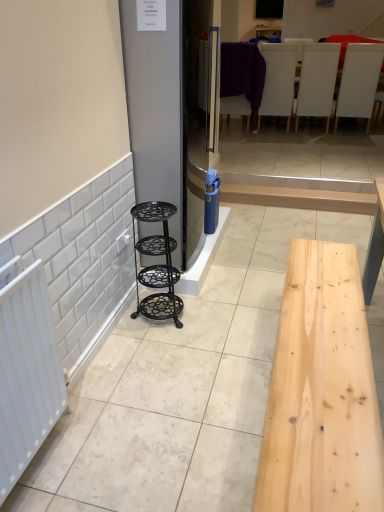
You are a GUI agent. You are given a task and a screenshot of the screen. Output one action in this format:
    pyautogui.click(x=<x>, y=<y>)
    Task: Click on the free spot below black wrought iron shelf at center left, marked as the 1th furniture in a front-to-back arrangement (from a real-world perspective)
    This screenshot has width=384, height=512.
    Given the screenshot: What is the action you would take?
    pyautogui.click(x=175, y=314)